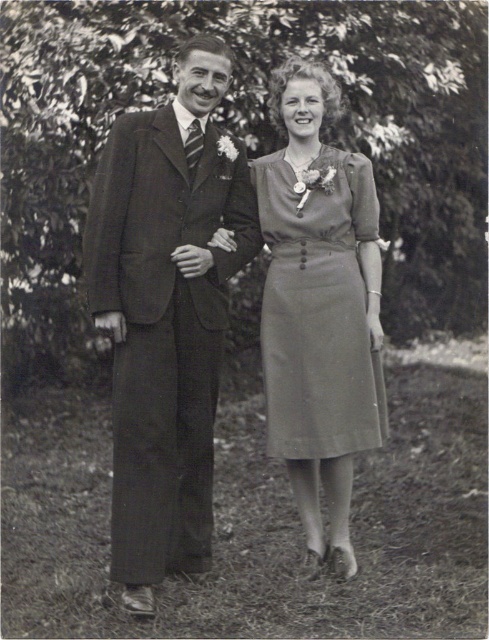
From the picture: Does matte dark suit at left have a larger size compared to matte gray dress at center?

Yes.

What do you see at coordinates (167, 314) in the screenshot? This screenshot has height=640, width=489. I see `matte dark suit at left` at bounding box center [167, 314].

The image size is (489, 640). Find the location of `matte dark suit at left`. matte dark suit at left is located at coordinates (167, 314).